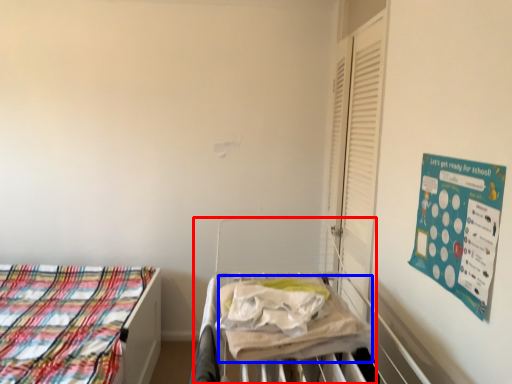
Question: Which point is further to the camera, hospital bed (highlighted by a red box) or blanket (highlighted by a blue box)?

Choices:
 (A) hospital bed
 (B) blanket

Answer: (B)